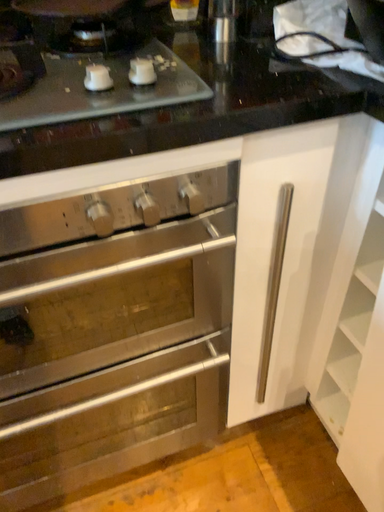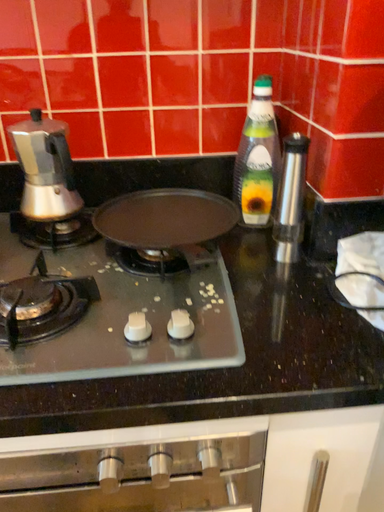
Question: Which way did the camera rotate in the video?

Choices:
 (A) rotated right
 (B) rotated left

Answer: (B)